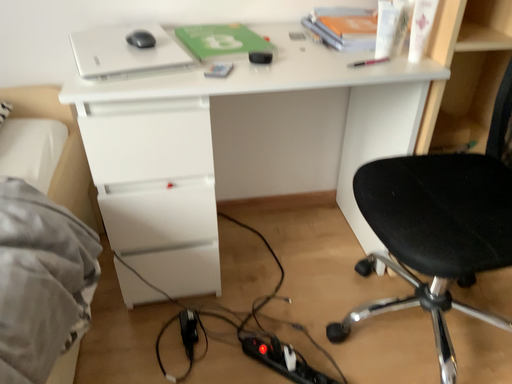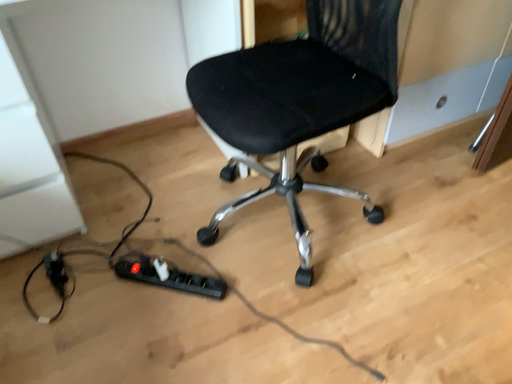
Question: How did the camera likely rotate when shooting the video?

Choices:
 (A) rotated right
 (B) rotated left

Answer: (A)